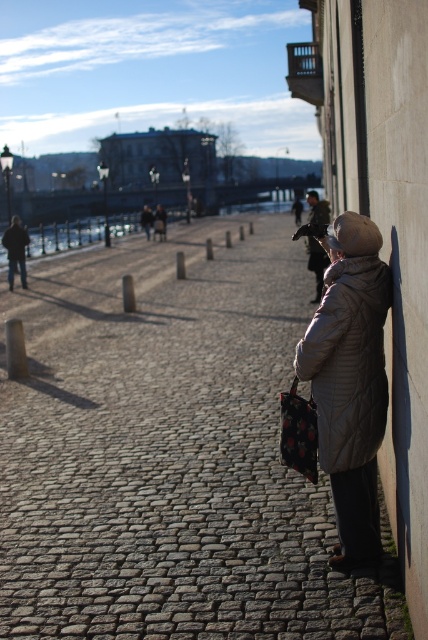
You are a delivery person who needs to place a small package on the cobblestone pavement at right. However, there is a matte beige coat at right nearby. Which object occupies more space in the scene?

The cobblestone pavement at right has a larger size compared to the matte beige coat at right, so the cobblestone pavement at right occupies more space in the scene.

You are a pedestrian standing on the cobblestone pavement at right and want to move towards the matte beige coat at right. Which direction should you walk to get closer to the coat?

The cobblestone pavement at right is to the left of the matte beige coat at right, so you should walk to the right to move closer to the coat.